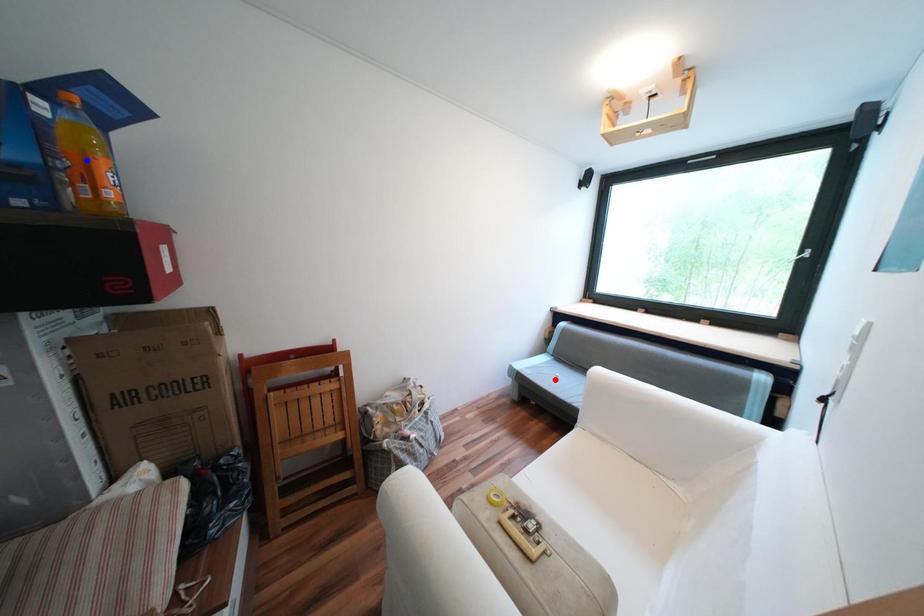
Question: In the image, two points are highlighted. Which point is nearer to the camera? Reply with the corresponding letter.

Choices:
 (A) blue point
 (B) red point

Answer: (A)